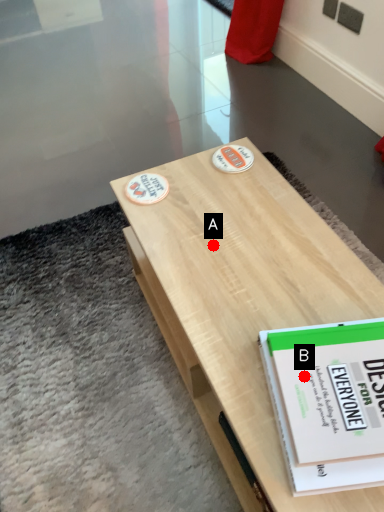
Question: Two points are circled on the image, labeled by A and B beside each circle. Among these points, which one is nearest to the camera?

Choices:
 (A) A is closer
 (B) B is closer

Answer: (B)